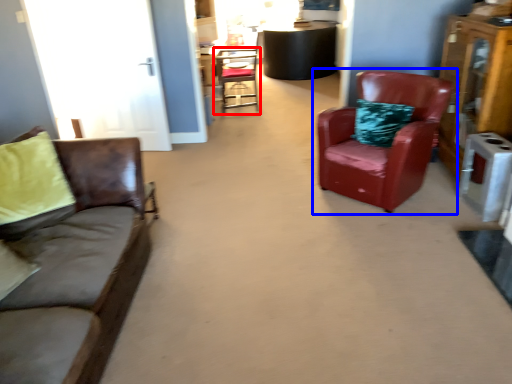
Question: Among these objects, which one is farthest to the camera, chair (highlighted by a red box) or chair (highlighted by a blue box)?

Choices:
 (A) chair
 (B) chair

Answer: (A)